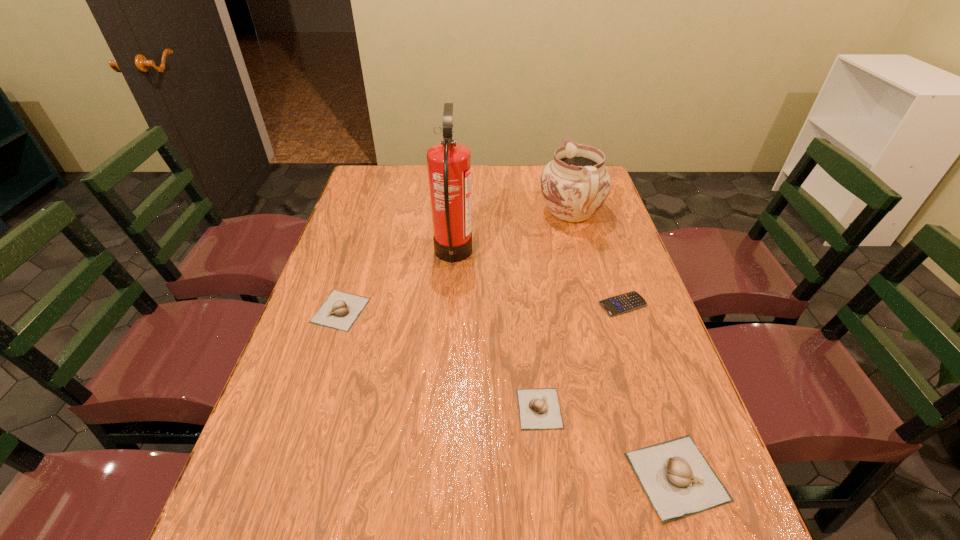
This screenshot has height=540, width=960. What are the coordinates of `free space between the fifth tallest object and the fifth shortest object` in the screenshot? It's located at (556, 311).

This screenshot has height=540, width=960. I want to click on free space between the fourth shortest object and the second tallest garlic, so pyautogui.click(x=509, y=394).

Where is `object that stands as the fourth closest to the shortest garlic`? The image size is (960, 540). object that stands as the fourth closest to the shortest garlic is located at coordinates (340, 310).

You are a GUI agent. You are given a task and a screenshot of the screen. Output one action in this format:
    pyautogui.click(x=<x>, y=<y>)
    Task: Click on the object that is the second nearest to the fifth shortest object
    
    Given the screenshot: What is the action you would take?
    coord(626,302)

Choose which garlic is the nearest neighbor to the second tallest garlic. Please provide its 2D coordinates. Your answer should be formatted as a tuple, i.e. [(x, y)], where the tuple contains the x and y coordinates of a point satisfying the conditions above.

[(539, 408)]

At what (x,y) coordinates should I click in order to perform the action: click on the third closest garlic relative to the calculator. Please return your answer as a coordinate pair (x, y). Looking at the image, I should click on coord(340,310).

Identify the location of vacant point that satisfies the following two spatial constraints: 1. on the back side of the shortest object; 2. on the front-facing side of the tallest object. (607, 255).

Identify the location of free location that satisfies the following two spatial constraints: 1. on the front-facing side of the fire extinguisher; 2. on the right side of the third object from left to right. (443, 409).